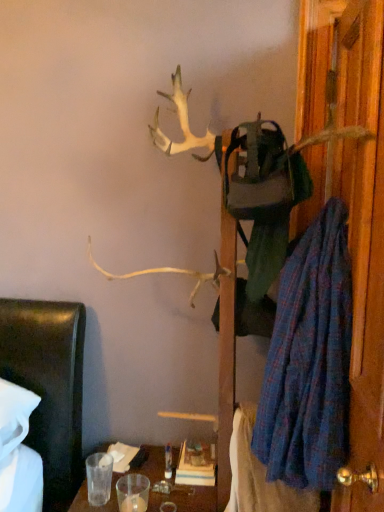
Find the location of a particular element. This screenshot has height=512, width=384. wooden door at right is located at coordinates (363, 217).

What do you see at coordinates (309, 360) in the screenshot? This screenshot has width=384, height=512. I see `blue plaid robe at right` at bounding box center [309, 360].

You are a GUI agent. You are given a task and a screenshot of the screen. Output one action in this format:
    pyautogui.click(x=<x>, y=<y>)
    Task: Click on the wooden door at right
    The height and width of the screenshot is (512, 384).
    Given the screenshot: What is the action you would take?
    pyautogui.click(x=363, y=217)

Does blue plaid robe at right have a lesser width compared to wooden door at right?

Yes.

From the image's perspective, which is above, blue plaid robe at right or wooden door at right?

wooden door at right is shown above in the image.

Is blue plaid robe at right positioned in front of wooden door at right?

No, it is not.

Does blue plaid robe at right have a lesser height compared to wooden door at right?

Yes.

Where is `blanket below the blue plaid robe at right (from the image's perspective)`? The width and height of the screenshot is (384, 512). blanket below the blue plaid robe at right (from the image's perspective) is located at coordinates (259, 475).

Between blue plaid blanket at lower right and blue plaid robe at right, which one is positioned behind?

blue plaid blanket at lower right is further from the camera.

From the image's perspective, which is above, blue plaid blanket at lower right or blue plaid robe at right?

blue plaid robe at right.

Between blue plaid blanket at lower right and blue plaid robe at right, which one has smaller width?

With smaller width is blue plaid robe at right.

From a real-world perspective, which is physically above, blue plaid blanket at lower right or wooden door at right?

In real-world perspective, wooden door at right is above.

Does blue plaid blanket at lower right appear on the right side of wooden door at right?

No, blue plaid blanket at lower right is not to the right of wooden door at right.

From the image's perspective, which is below, blue plaid blanket at lower right or wooden door at right?

blue plaid blanket at lower right, from the image's perspective.

Is blue plaid blanket at lower right smaller than wooden door at right?

Correct, blue plaid blanket at lower right occupies less space than wooden door at right.

Which object is thinner, wooden door at right or blue plaid blanket at lower right?

blue plaid blanket at lower right is thinner.

Can you confirm if wooden door at right is shorter than blue plaid blanket at lower right?

Incorrect, the height of wooden door at right does not fall short of that of blue plaid blanket at lower right.

Is wooden door at right positioned in front of blue plaid blanket at lower right?

Yes, wooden door at right is in front of blue plaid blanket at lower right.

Is wooden door at right bigger or smaller than blue plaid robe at right?

Considering their sizes, wooden door at right takes up less space than blue plaid robe at right.

In the image, is wooden door at right positioned in front of or behind blue plaid robe at right?

Visually, wooden door at right is located in front of blue plaid robe at right.

At what (x,y) coordinates should I click in order to perform the action: click on robe that is under the wooden door at right (from a real-world perspective). Please return your answer as a coordinate pair (x, y). The height and width of the screenshot is (512, 384). Looking at the image, I should click on tap(309, 360).

Is blue plaid robe at right outside of blue plaid blanket at lower right?

Yes, blue plaid robe at right is outside of blue plaid blanket at lower right.

In the image, is blue plaid robe at right on the left side or the right side of blue plaid blanket at lower right?

blue plaid robe at right is positioned on blue plaid blanket at lower right's right side.

Consider the image. Is blue plaid robe at right facing away from blue plaid blanket at lower right?

blue plaid robe at right is not turned away from blue plaid blanket at lower right.

Based on their sizes in the image, would you say blue plaid robe at right is bigger or smaller than blue plaid blanket at lower right?

Clearly, blue plaid robe at right is larger in size than blue plaid blanket at lower right.

Identify the location of door that appears in front of the blue plaid robe at right. The height and width of the screenshot is (512, 384). (363, 217).

Find the location of a particular element. This screenshot has width=384, height=512. robe on the right of blue plaid blanket at lower right is located at coordinates (309, 360).

Looking at this image, based on their spatial positions, is wooden door at right or blue plaid robe at right further from blue plaid blanket at lower right?

Based on the image, wooden door at right appears to be further to blue plaid blanket at lower right.

Which object lies nearer to the anchor point blue plaid blanket at lower right, blue plaid robe at right or wooden door at right?

Among the two, blue plaid robe at right is located nearer to blue plaid blanket at lower right.

Which object lies further to the anchor point blue plaid robe at right, blue plaid blanket at lower right or wooden door at right?

blue plaid blanket at lower right is positioned further to the anchor blue plaid robe at right.

Estimate the real-world distances between objects in this image. Which object is further from blue plaid robe at right, wooden door at right or blue plaid blanket at lower right?

blue plaid blanket at lower right.

Estimate the real-world distances between objects in this image. Which object is further from wooden door at right, blue plaid robe at right or blue plaid blanket at lower right?

Based on the image, blue plaid blanket at lower right appears to be further to wooden door at right.

Looking at the image, which one is located closer to wooden door at right, blue plaid blanket at lower right or blue plaid robe at right?

blue plaid robe at right is positioned closer to the anchor wooden door at right.

The width and height of the screenshot is (384, 512). Identify the location of robe between wooden door at right and blue plaid blanket at lower right from top to bottom. (309, 360).